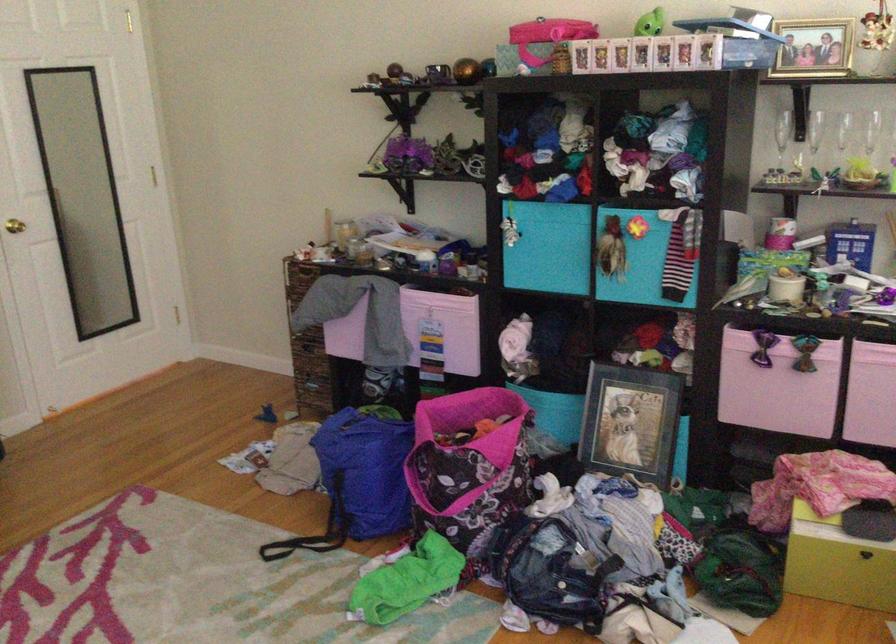
I want to click on gold door handle, so click(14, 225).